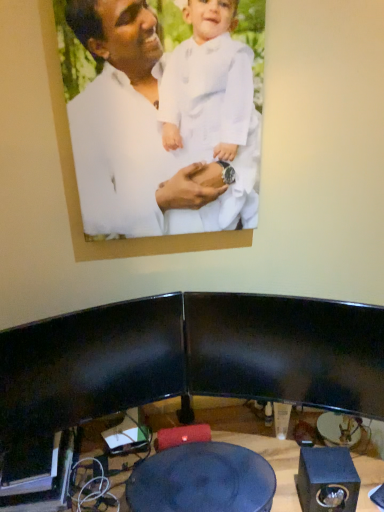
Question: Considering the relative sizes of blue glossy table at center and white matte picture frame at upper center in the image provided, is blue glossy table at center shorter than white matte picture frame at upper center?

Choices:
 (A) yes
 (B) no

Answer: (A)

Question: From a real-world perspective, does blue glossy table at center sit lower than white matte picture frame at upper center?

Choices:
 (A) no
 (B) yes

Answer: (B)

Question: Is blue glossy table at center smaller than white matte picture frame at upper center?

Choices:
 (A) yes
 (B) no

Answer: (B)

Question: Would you say blue glossy table at center is a long distance from white matte picture frame at upper center?

Choices:
 (A) yes
 (B) no

Answer: (B)

Question: From the image's perspective, is blue glossy table at center located beneath white matte picture frame at upper center?

Choices:
 (A) yes
 (B) no

Answer: (A)

Question: Is blue glossy table at center oriented away from white matte picture frame at upper center?

Choices:
 (A) no
 (B) yes

Answer: (A)

Question: Considering the relative positions of black matte speaker at lower right and blue glossy table at center in the image provided, is black matte speaker at lower right to the left of blue glossy table at center from the viewer's perspective?

Choices:
 (A) yes
 (B) no

Answer: (B)

Question: From a real-world perspective, is black matte speaker at lower right beneath blue glossy table at center?

Choices:
 (A) no
 (B) yes

Answer: (A)

Question: Is blue glossy table at center at the back of black matte speaker at lower right?

Choices:
 (A) no
 (B) yes

Answer: (A)

Question: Is black matte speaker at lower right not near blue glossy table at center?

Choices:
 (A) yes
 (B) no

Answer: (B)

Question: Does black matte speaker at lower right have a larger size compared to blue glossy table at center?

Choices:
 (A) yes
 (B) no

Answer: (B)

Question: From the image's perspective, does black matte speaker at lower right appear lower than blue glossy table at center?

Choices:
 (A) no
 (B) yes

Answer: (A)

Question: Is white matte picture frame at upper center in front of black matte speaker at lower right?

Choices:
 (A) yes
 (B) no

Answer: (A)